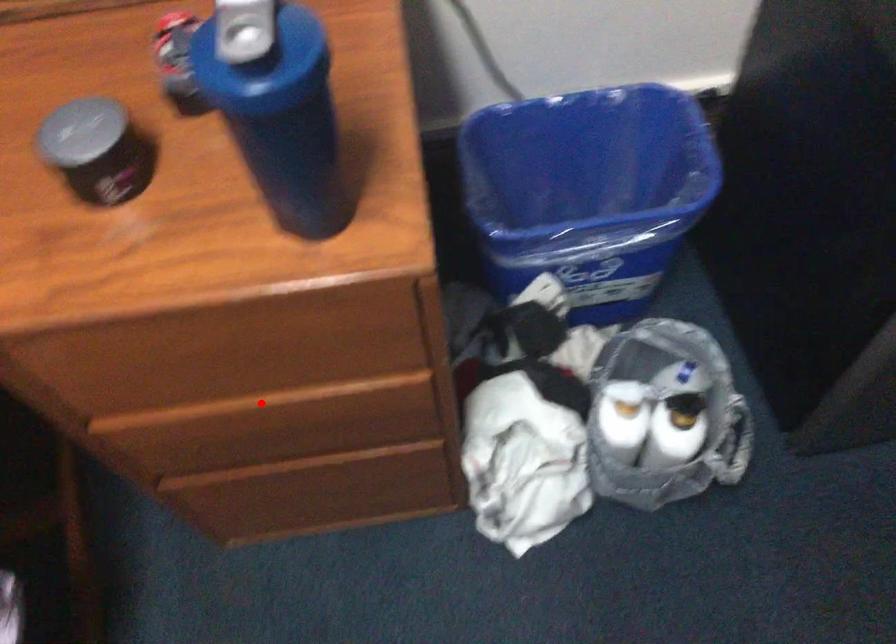
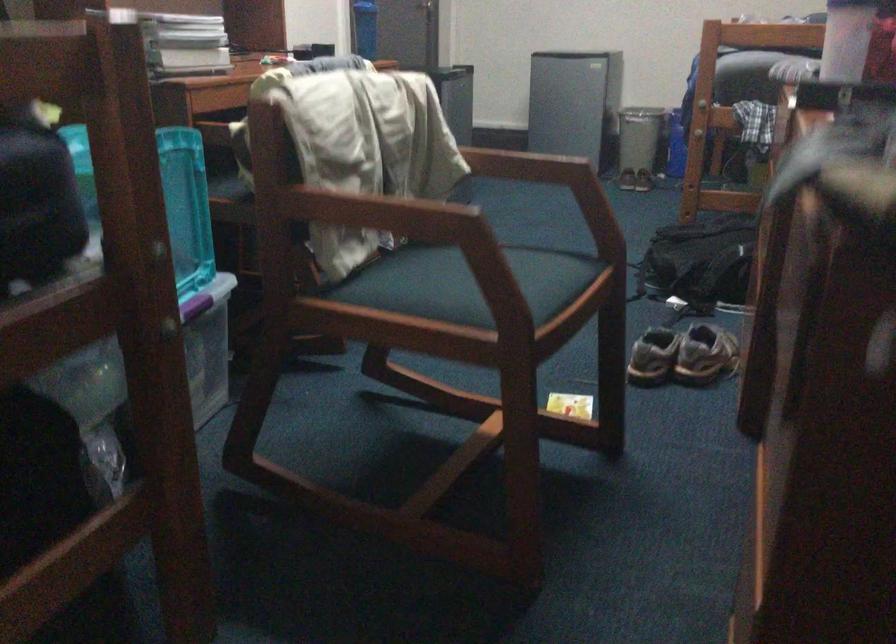
Question: I am providing you with two images of the same scene from different viewpoints. A red point is marked on the first image. Is the red point's position out of view in image 2?

Choices:
 (A) Yes
 (B) No

Answer: (A)